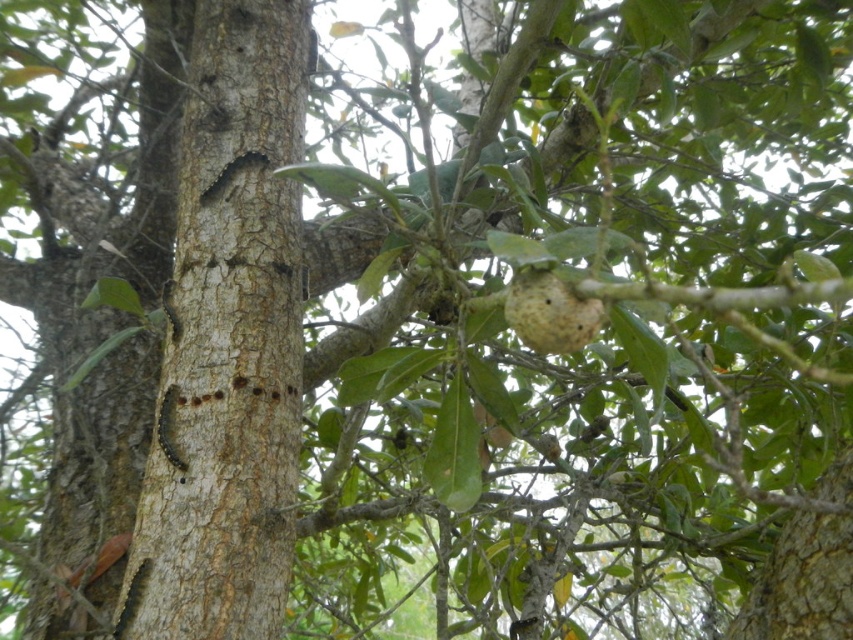
What are the coordinates of the rough bark tree trunk at center in the image?

The rough bark tree trunk at center is located at coordinates (228, 340).

You are an animal that needs to move from the rough bark tree trunk at center to the yellow matte fruit at center. Which path would require less effort, moving towards the wider object or the narrower object?

The rough bark tree trunk at center is wider than the yellow matte fruit at center. Moving towards the wider object requires less effort because it has a larger surface area for grip.